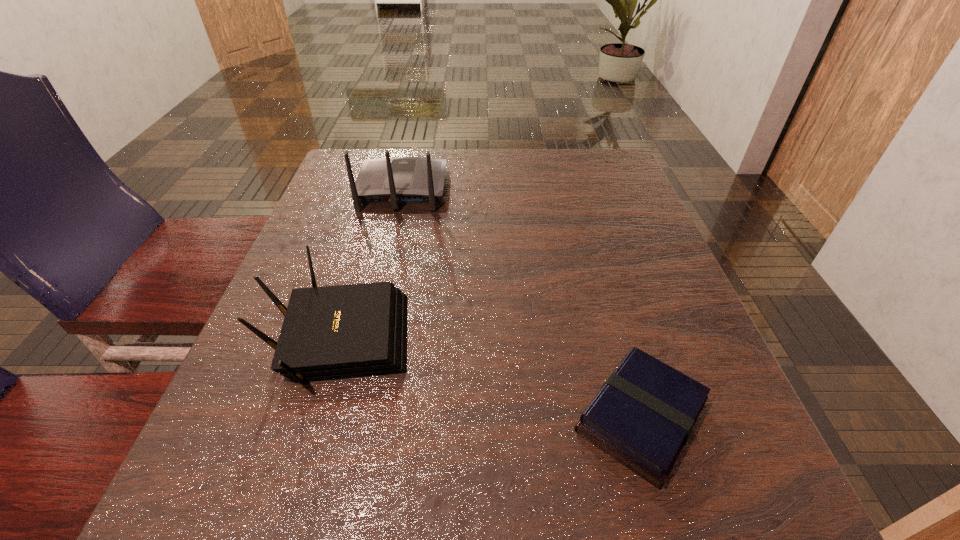
You are a GUI agent. You are given a task and a screenshot of the screen. Output one action in this format:
    pyautogui.click(x=<x>, y=<y>)
    Task: Click on the free space that is in between the taller router and the shorter router
    
    Given the screenshot: What is the action you would take?
    pyautogui.click(x=371, y=263)

Identify the location of unoccupied area between the shorter router and the farther router. This screenshot has width=960, height=540. (371, 263).

Where is `free spot between the rightmost object and the shorter router`? The height and width of the screenshot is (540, 960). free spot between the rightmost object and the shorter router is located at coordinates (490, 377).

Where is `free space that is in between the taller router and the second shortest object`? The image size is (960, 540). free space that is in between the taller router and the second shortest object is located at coordinates (371, 263).

Locate an element on the screen. free space between the farthest object and the shorter router is located at coordinates (371, 263).

I want to click on empty space that is in between the farthest object and the shorter router, so click(371, 263).

At what (x,y) coordinates should I click in order to perform the action: click on vacant area between the second tallest object and the farther router. Please return your answer as a coordinate pair (x, y). Looking at the image, I should click on (371, 263).

I want to click on unoccupied area between the rightmost object and the nearer router, so click(x=490, y=377).

In order to click on empty space between the shortest object and the nearer router in this screenshot , I will do `click(490, 377)`.

The height and width of the screenshot is (540, 960). Find the location of `vacant point located between the farther router and the second tallest object`. vacant point located between the farther router and the second tallest object is located at coordinates (371, 263).